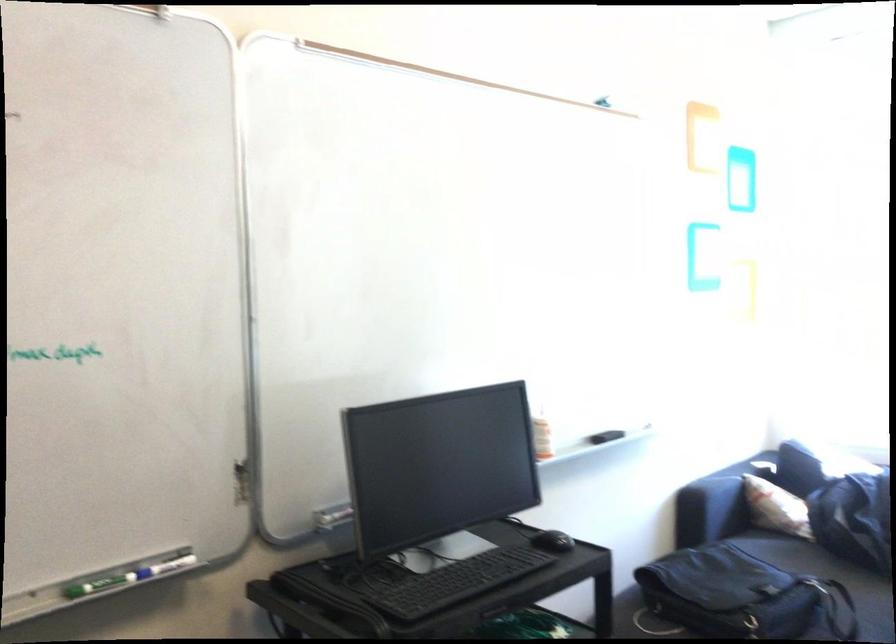
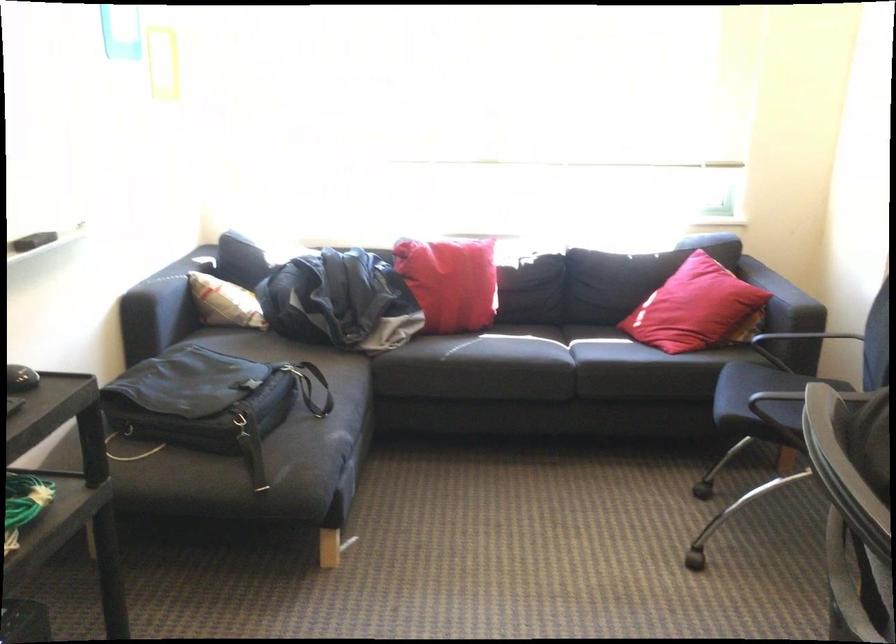
Question: The camera is either moving clockwise (left) or counter-clockwise (right) around the object. The first image is from the beginning of the video and the second image is from the end. Is the camera moving left or right when shooting the video?

Choices:
 (A) Left
 (B) Right

Answer: (A)